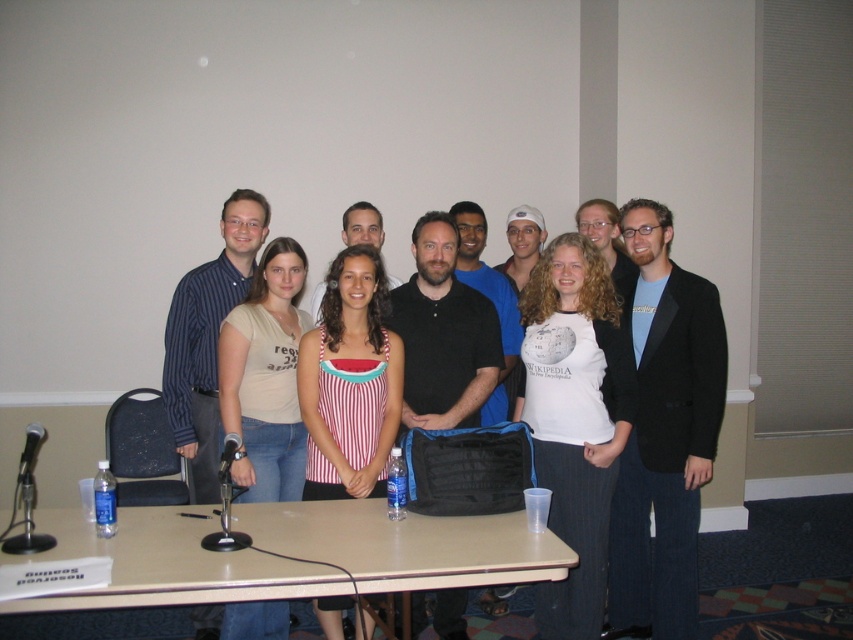
Question: Which object is positioned closest to the beige laminate table at lower center?

Choices:
 (A) black matte blazer at right
 (B) white cotton t-shirt at center

Answer: (B)

Question: In this image, where is black matte blazer at right located relative to white cotton t-shirt at center?

Choices:
 (A) above
 (B) below

Answer: (A)

Question: Is white cotton shirt at center positioned at the back of beige laminate table at lower center?

Choices:
 (A) yes
 (B) no

Answer: (A)

Question: Which of the following is the closest to the observer?

Choices:
 (A) white cotton t-shirt at center
 (B) black matte blazer at right

Answer: (A)

Question: Is beige laminate table at lower center smaller than white cotton t-shirt at center?

Choices:
 (A) no
 (B) yes

Answer: (B)

Question: Which of the following is the farthest from the observer?

Choices:
 (A) beige laminate table at lower center
 (B) white cotton shirt at center

Answer: (B)